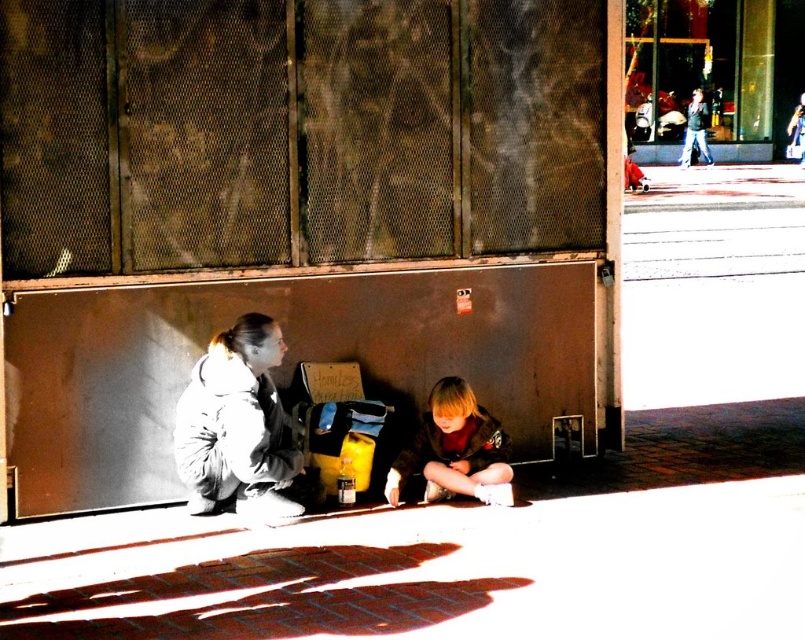
Does white fleece jacket at lower left appear under dark gray jacket at upper right?

Yes.

In order to click on white fleece jacket at lower left in this screenshot , I will do `click(237, 426)`.

The width and height of the screenshot is (805, 640). I want to click on white fleece jacket at lower left, so click(x=237, y=426).

Is blonde hair boy at lower center positioned in front of dark gray jacket at upper right?

Yes.

Can you confirm if blonde hair boy at lower center is positioned to the left of dark gray jacket at upper right?

Indeed, blonde hair boy at lower center is positioned on the left side of dark gray jacket at upper right.

Find the location of a particular element. blonde hair boy at lower center is located at coordinates (453, 451).

Who is shorter, white fleece jacket at lower left or blonde hair boy at lower center?

blonde hair boy at lower center

Does point (267, 436) come in front of point (469, 417)?

Yes, it is.

At what (x,y) coordinates should I click in order to perform the action: click on white fleece jacket at lower left. Please return your answer as a coordinate pair (x, y). This screenshot has width=805, height=640. Looking at the image, I should click on (237, 426).